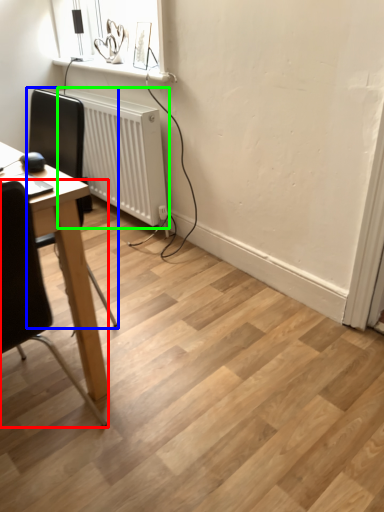
Question: Estimate the real-world distances between objects in this image. Which object is closer to chair (highlighted by a red box), chair (highlighted by a blue box) or radiator (highlighted by a green box)?

Choices:
 (A) chair
 (B) radiator

Answer: (B)